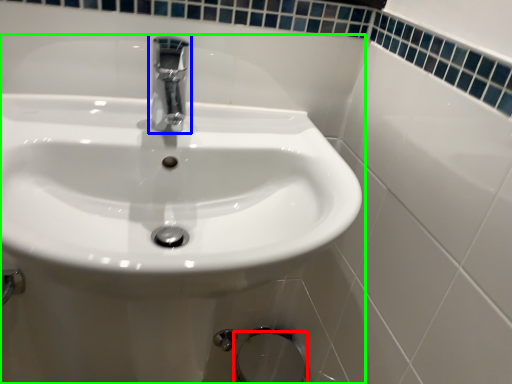
Question: Which object is the farthest from bidet (highlighted by a red box)? Choose among these: tap (highlighted by a blue box) or sink (highlighted by a green box).

Choices:
 (A) tap
 (B) sink

Answer: (A)